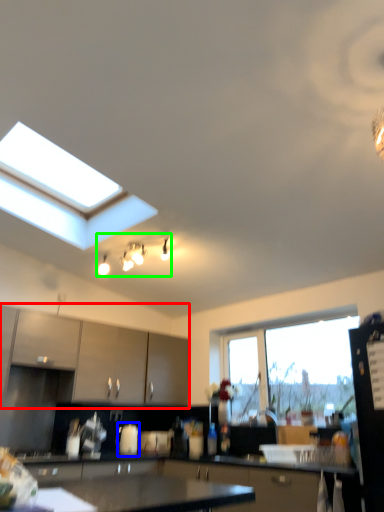
Question: Which is nearer to the cabinetry (highlighted by a red box)? appliance (highlighted by a blue box) or light fixture (highlighted by a green box).

Choices:
 (A) appliance
 (B) light fixture

Answer: (A)